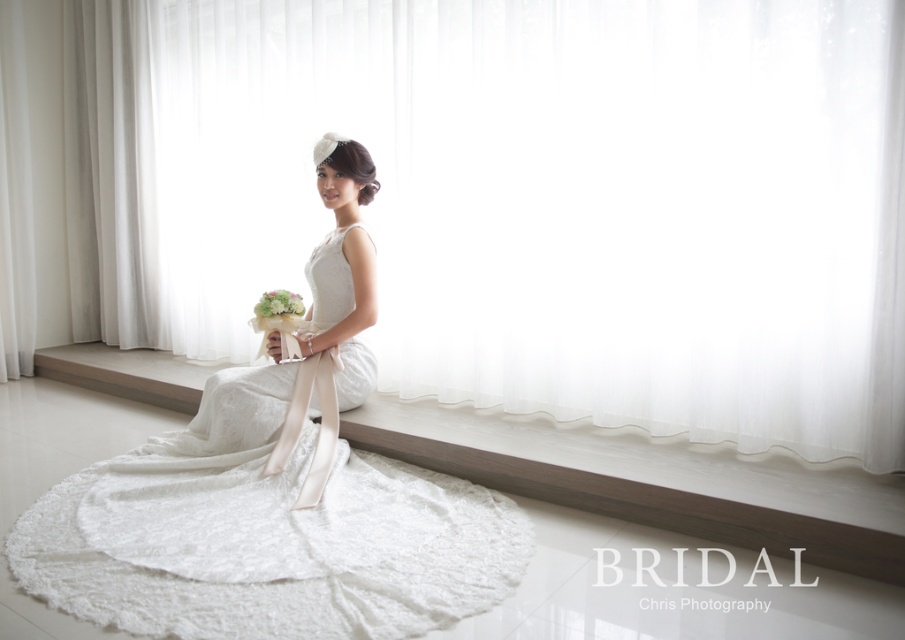
Does white sheer curtain at center have a lesser width compared to white lace dress at center?

No.

Between point (861, 445) and point (317, 332), which one is positioned behind?

The point (317, 332) is more distant.

Image resolution: width=905 pixels, height=640 pixels. In order to click on white sheer curtain at center in this screenshot , I will do `click(518, 198)`.

Is white lace dress at center to the right of green fabric bouquet at center from the viewer's perspective?

Correct, you'll find white lace dress at center to the right of green fabric bouquet at center.

Does white lace dress at center have a greater width compared to green fabric bouquet at center?

Correct, the width of white lace dress at center exceeds that of green fabric bouquet at center.

Does point (237, 483) come behind point (256, 312)?

No, (237, 483) is closer to viewer.

Locate an element on the screen. The image size is (905, 640). white lace dress at center is located at coordinates (275, 497).

Between point (684, 310) and point (268, 296), which one is positioned behind?

The point (268, 296) is more distant.

Is point (214, 36) behind point (272, 310)?

Yes, it is.

The image size is (905, 640). Find the location of `white sheer curtain at center`. white sheer curtain at center is located at coordinates point(518,198).